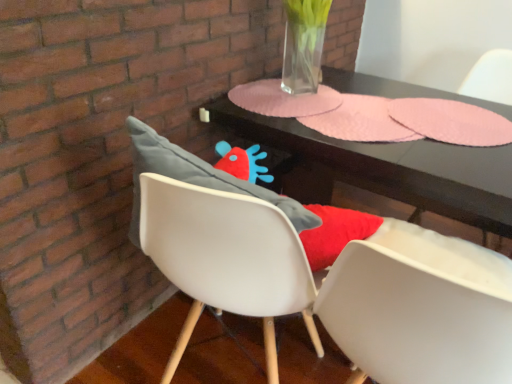
Question: From a real-world perspective, does matte gray cushion at center sit lower than white matte armchair at upper right?

Choices:
 (A) no
 (B) yes

Answer: (B)

Question: From the image's perspective, would you say matte gray cushion at center is positioned over white matte armchair at upper right?

Choices:
 (A) no
 (B) yes

Answer: (A)

Question: Is white matte armchair at upper right at the back of matte gray cushion at center?

Choices:
 (A) no
 (B) yes

Answer: (A)

Question: Does matte gray cushion at center have a lesser width compared to white matte armchair at upper right?

Choices:
 (A) no
 (B) yes

Answer: (A)

Question: Can you confirm if matte gray cushion at center is shorter than white matte armchair at upper right?

Choices:
 (A) no
 (B) yes

Answer: (B)

Question: Is matte gray cushion at center at the left side of white matte armchair at upper right?

Choices:
 (A) no
 (B) yes

Answer: (B)

Question: From the image's perspective, is white matte armchair at upper right below pink paper placemats at center?

Choices:
 (A) no
 (B) yes

Answer: (B)

Question: From a real-world perspective, is white matte armchair at upper right physically above pink paper placemats at center?

Choices:
 (A) no
 (B) yes

Answer: (A)

Question: Can you confirm if white matte armchair at upper right is thinner than pink paper placemats at center?

Choices:
 (A) yes
 (B) no

Answer: (A)

Question: Could you tell me if white matte armchair at upper right is turned towards pink paper placemats at center?

Choices:
 (A) yes
 (B) no

Answer: (B)

Question: Would you consider white matte armchair at upper right to be distant from pink paper placemats at center?

Choices:
 (A) no
 (B) yes

Answer: (A)

Question: Is the depth of white matte armchair at upper right greater than that of pink paper placemats at center?

Choices:
 (A) no
 (B) yes

Answer: (B)

Question: From a real-world perspective, is white matte armchair at upper right located beneath matte gray cushion at center?

Choices:
 (A) no
 (B) yes

Answer: (A)